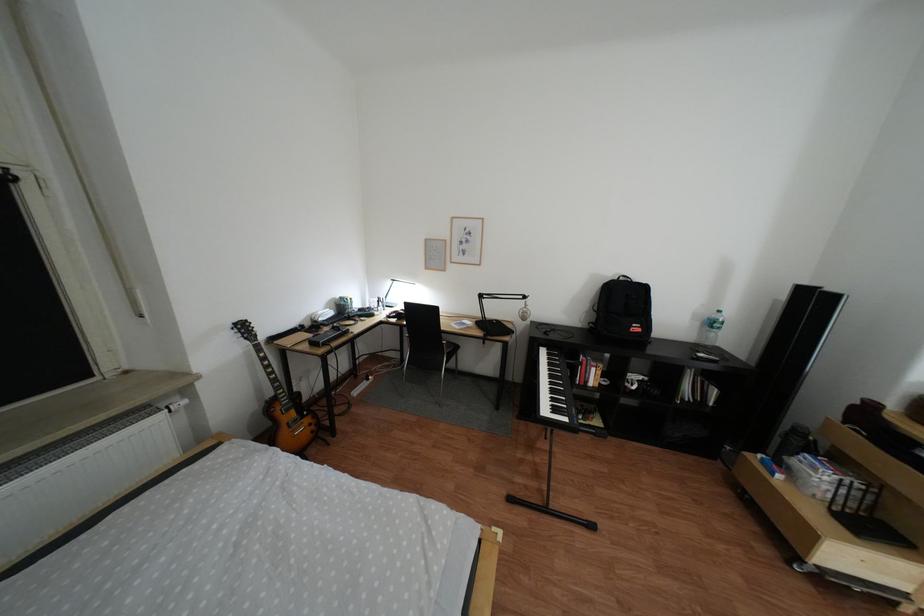
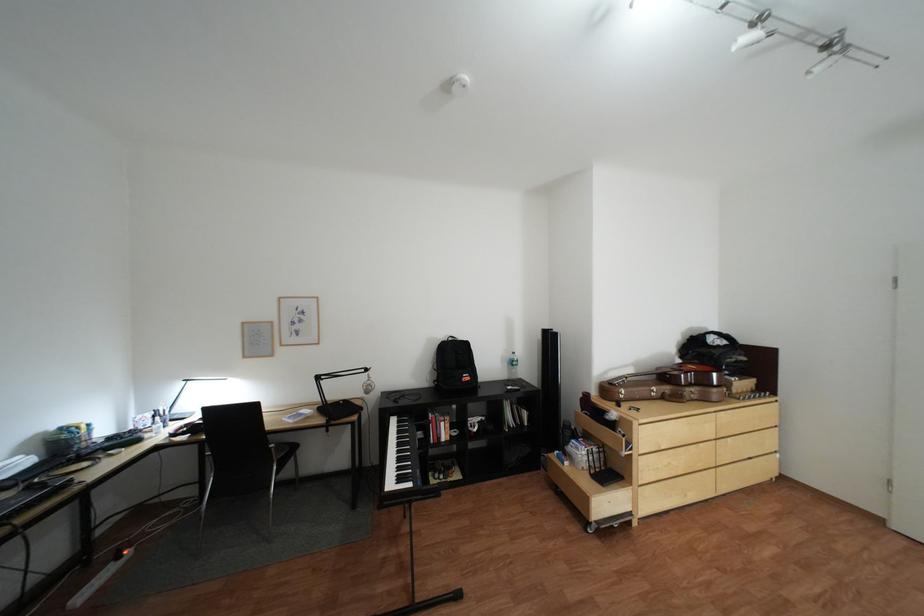
The point at (638, 280) is marked in the first image. Where is the corresponding point in the second image?

(466, 339)